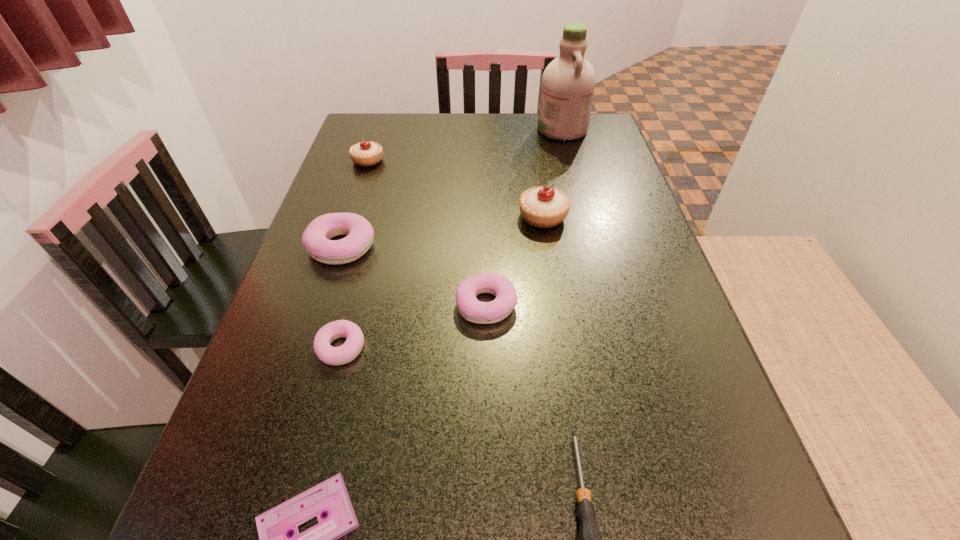
This screenshot has width=960, height=540. Find the location of `pastry at the far edge`. pastry at the far edge is located at coordinates (366, 153).

I want to click on object located at the right edge, so click(568, 83).

Identify the location of object that is at the far left corner. The width and height of the screenshot is (960, 540). (366, 153).

You are a GUI agent. You are given a task and a screenshot of the screen. Output one action in this format:
    pyautogui.click(x=<x>, y=<y>)
    Task: Click on the object located at the far right corner
    
    Given the screenshot: What is the action you would take?
    pyautogui.click(x=568, y=83)

In the image, there is a desktop. Where is `free space at the far edge`? Image resolution: width=960 pixels, height=540 pixels. free space at the far edge is located at coordinates (535, 144).

The height and width of the screenshot is (540, 960). In the image, there is a desktop. What are the coordinates of `vacant space at the left edge` in the screenshot? It's located at (231, 428).

Identify the location of vacant space at the right edge of the desktop. (605, 190).

You are a GUI agent. You are given a task and a screenshot of the screen. Output one action in this format:
    pyautogui.click(x=<x>, y=<y>)
    Task: Click on the vacant region at the far right corner of the desktop
    
    Given the screenshot: What is the action you would take?
    pyautogui.click(x=616, y=149)

The image size is (960, 540). In order to click on free space at the near right corner of the desktop in this screenshot , I will do `click(700, 538)`.

I want to click on free spot between the tallest object and the sixth shortest object, so click(465, 145).